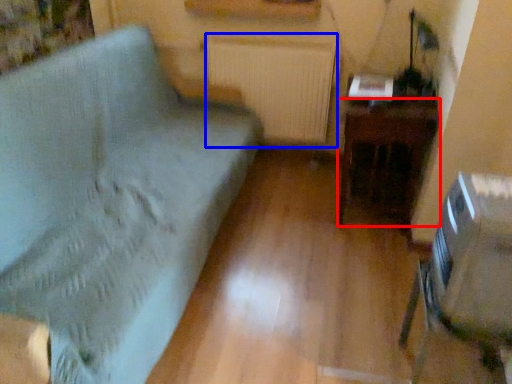
Question: Which point is closer to the camera, table (highlighted by a red box) or radiator (highlighted by a blue box)?

Choices:
 (A) table
 (B) radiator

Answer: (A)